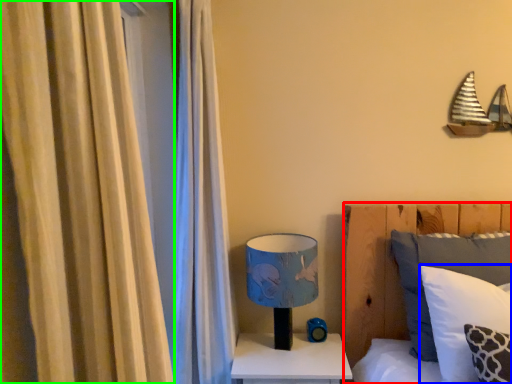
Question: Considering the real-world distances, which object is farthest from bed (highlighted by a red box)? pillow (highlighted by a blue box) or curtain (highlighted by a green box)?

Choices:
 (A) pillow
 (B) curtain

Answer: (B)